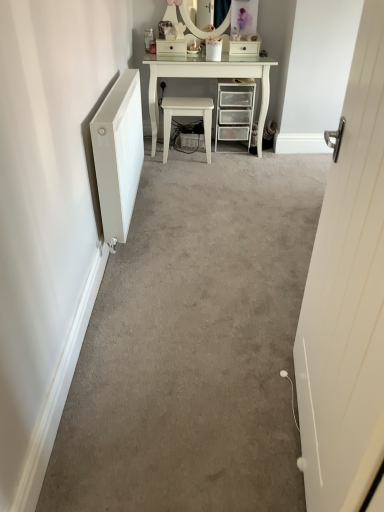
Question: From a real-world perspective, is white glossy drawer at upper center, arranged as the second drawer when viewed from the right, beneath white glossy drawer at upper center, acting as the 1th drawer starting from the right?

Choices:
 (A) yes
 (B) no

Answer: (B)

Question: Is white glossy drawer at upper center, acting as the 1th drawer starting from the left, positioned beyond the bounds of white glossy drawer at upper center, acting as the 1th drawer starting from the right?

Choices:
 (A) no
 (B) yes

Answer: (B)

Question: From the image's perspective, does white glossy drawer at upper center, acting as the 1th drawer starting from the left, appear higher than white glossy drawer at upper center, acting as the 1th drawer starting from the right?

Choices:
 (A) yes
 (B) no

Answer: (A)

Question: Would you say white glossy drawer at upper center, acting as the 1th drawer starting from the right, is part of white glossy drawer at upper center, arranged as the second drawer when viewed from the right,'s contents?

Choices:
 (A) yes
 (B) no

Answer: (B)

Question: From the image's perspective, is white glossy drawer at upper center, arranged as the second drawer when viewed from the right, below white glossy drawer at upper center, the 2th drawer viewed from the left?

Choices:
 (A) no
 (B) yes

Answer: (A)

Question: Considering the positions of clear plastic drawers at center and white wooden door at right in the image, is clear plastic drawers at center bigger or smaller than white wooden door at right?

Choices:
 (A) small
 (B) big

Answer: (A)

Question: Is clear plastic drawers at center to the left or to the right of white wooden door at right in the image?

Choices:
 (A) right
 (B) left

Answer: (B)

Question: From the image's perspective, is clear plastic drawers at center positioned above or below white wooden door at right?

Choices:
 (A) below
 (B) above

Answer: (B)

Question: Is clear plastic drawers at center in front of or behind white wooden door at right in the image?

Choices:
 (A) behind
 (B) front

Answer: (A)

Question: Is white glossy vanity at upper center wider or thinner than white glossy stool at center?

Choices:
 (A) wide
 (B) thin

Answer: (A)

Question: Which is correct: white glossy vanity at upper center is inside white glossy stool at center, or outside of it?

Choices:
 (A) outside
 (B) inside

Answer: (A)

Question: Is white glossy vanity at upper center bigger or smaller than white glossy stool at center?

Choices:
 (A) big
 (B) small

Answer: (A)

Question: From the image's perspective, is white glossy vanity at upper center located above or below white glossy stool at center?

Choices:
 (A) below
 (B) above

Answer: (B)

Question: From the image's perspective, is white glossy drawer at upper center, acting as the 1th drawer starting from the left, above or below white glossy drawer at upper center, the 2th drawer viewed from the left?

Choices:
 (A) above
 (B) below

Answer: (A)

Question: Visually, is white glossy drawer at upper center, acting as the 1th drawer starting from the left, positioned to the left or to the right of white glossy drawer at upper center, acting as the 1th drawer starting from the right?

Choices:
 (A) left
 (B) right

Answer: (A)